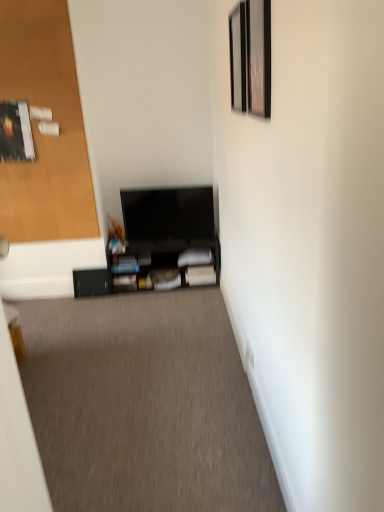
Question: Relative to black matte shelf at lower center, acting as the 1th shelf starting from the left, is wooden picture frame at upper right, the 1th picture frame in the back-to-front sequence, in front or behind?

Choices:
 (A) front
 (B) behind

Answer: (A)

Question: From the image's perspective, is wooden picture frame at upper right, placed as the 2th picture frame when sorted from front to back, located above or below black matte shelf at lower center, acting as the 1th shelf starting from the left?

Choices:
 (A) above
 (B) below

Answer: (A)

Question: Which is farther from the wooden door at left?

Choices:
 (A) matte black shelf at center, which is the 1th shelf in right-to-left order
 (B) metallic silver picture frame at upper right, placed as the 2th picture frame when sorted from back to front
 (C) wooden picture frame at upper right, placed as the 2th picture frame when sorted from front to back
 (D) black matte shelf at lower center, acting as the 1th shelf starting from the left
 (E) black matte tv at center

Answer: (B)

Question: Which object is the farthest from the wooden door at left?

Choices:
 (A) wooden picture frame at upper right, the 1th picture frame in the back-to-front sequence
 (B) metallic silver picture frame at upper right, acting as the 1th picture frame starting from the front
 (C) matte black shelf at center, arranged as the 2th shelf when viewed from the left
 (D) black matte tv at center
 (E) black matte shelf at lower center, acting as the 1th shelf starting from the left

Answer: (B)